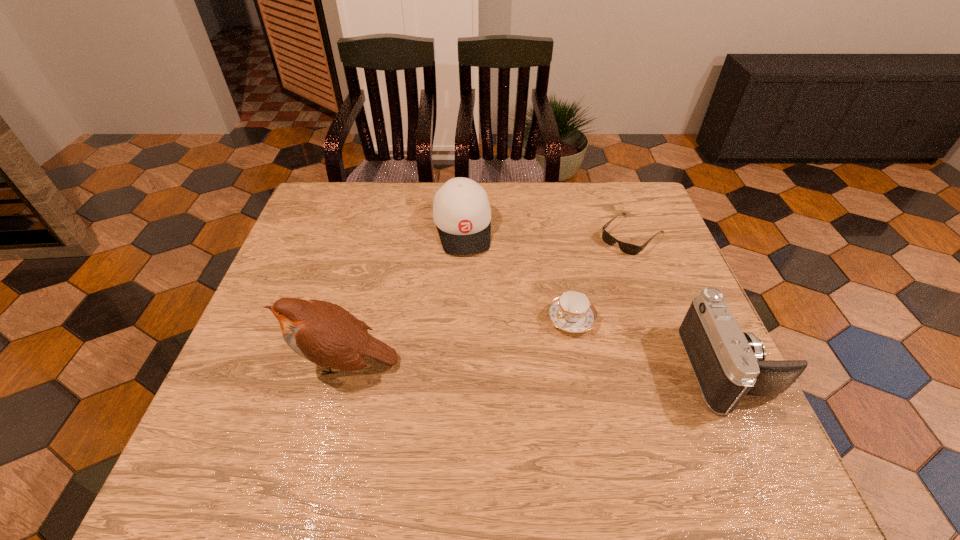
Identify the location of blank region between the camera and the teacup. (650, 343).

Where is `free area in between the camera and the third object from left to right`? The height and width of the screenshot is (540, 960). free area in between the camera and the third object from left to right is located at coordinates (650, 343).

What are the coordinates of `vacant point located between the third shortest object and the leftmost object` in the screenshot? It's located at (403, 295).

Find the location of a particular element. This screenshot has height=540, width=960. free space between the third tallest object and the sunglasses is located at coordinates (547, 231).

Where is `vacant area between the teacup and the fourth object from right to left`? This screenshot has height=540, width=960. vacant area between the teacup and the fourth object from right to left is located at coordinates (516, 274).

I want to click on free point between the sunglasses and the camera, so click(x=681, y=301).

Find the location of `object that is the third closest to the sunglasses`. object that is the third closest to the sunglasses is located at coordinates (461, 211).

Locate an element on the screen. Image resolution: width=960 pixels, height=540 pixels. object that is the fourth closest to the camera is located at coordinates (324, 333).

Where is `free location that satisfies the following two spatial constraints: 1. on the front side of the camera; 2. at the front of the baseball cap with an open lens cover`? This screenshot has width=960, height=540. free location that satisfies the following two spatial constraints: 1. on the front side of the camera; 2. at the front of the baseball cap with an open lens cover is located at coordinates coord(456,368).